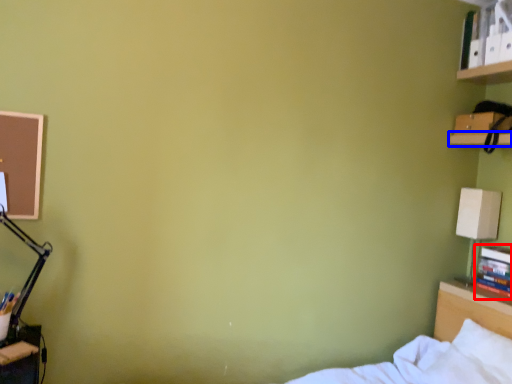
Question: Among these objects, which one is farthest to the camera, book (highlighted by a red box) or shelf (highlighted by a blue box)?

Choices:
 (A) book
 (B) shelf

Answer: (A)